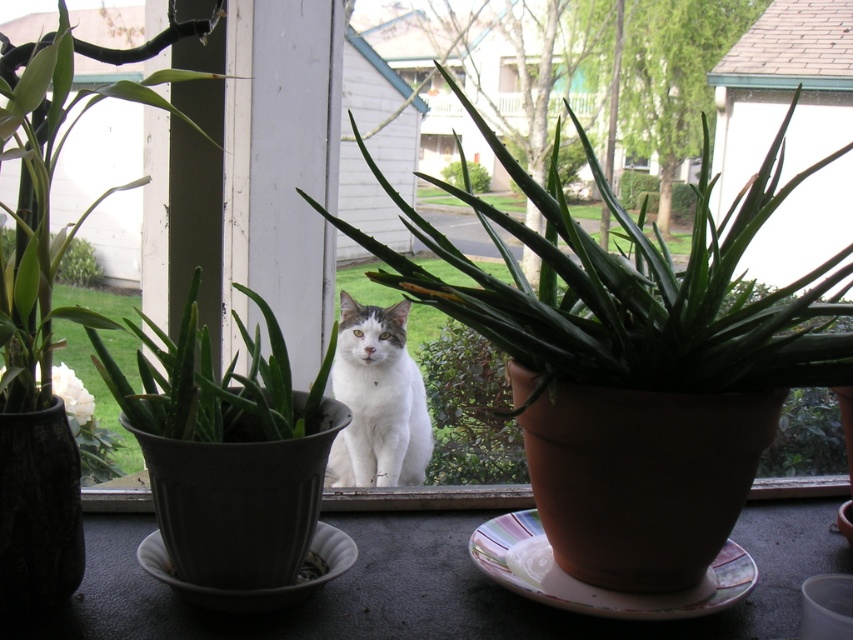
Is white soft fur cat at center thinner than green leafy plant at center?

Yes, white soft fur cat at center is thinner than green leafy plant at center.

Is white soft fur cat at center above green leafy plant at center?

No.

The height and width of the screenshot is (640, 853). I want to click on white soft fur cat at center, so click(x=376, y=400).

Where is `white soft fur cat at center`? white soft fur cat at center is located at coordinates (376, 400).

Is green matte plant at left above green leafy plant at center?

No, green matte plant at left is not above green leafy plant at center.

Does green matte plant at left have a greater height compared to green leafy plant at center?

Yes, green matte plant at left is taller than green leafy plant at center.

Is point (51, 35) closer to viewer compared to point (473, 179)?

Yes, it is.

You are a GUI agent. You are given a task and a screenshot of the screen. Output one action in this format:
    pyautogui.click(x=<x>, y=<y>)
    Task: Click on the green matte plant at left
    The image size is (853, 640).
    Given the screenshot: What is the action you would take?
    pyautogui.click(x=50, y=189)

Which of these two, green matte aloe vera at center or white soft fur cat at center, stands shorter?

Standing shorter between the two is white soft fur cat at center.

Does green matte aloe vera at center have a greater height compared to white soft fur cat at center?

Yes.

Is point (608, 294) behind point (386, 419)?

No, (608, 294) is closer to viewer.

This screenshot has height=640, width=853. In order to click on green matte aloe vera at center in this screenshot , I will do `click(633, 291)`.